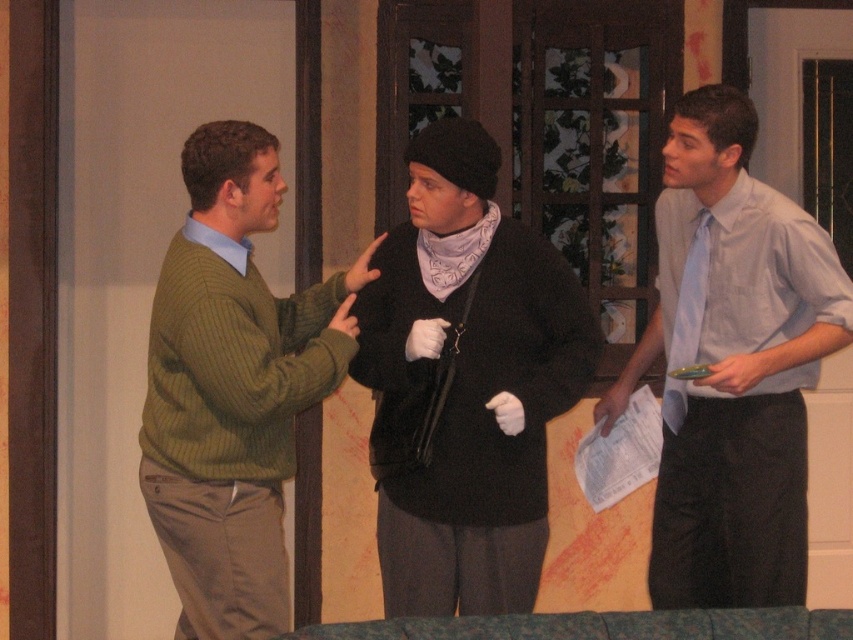
Question: Can you confirm if light blue shirt at right is positioned below green ribbed sweater at left?

Choices:
 (A) no
 (B) yes

Answer: (A)

Question: Which object appears closest to the camera in this image?

Choices:
 (A) light blue shirt at right
 (B) green ribbed sweater at left
 (C) black sweater at center

Answer: (B)

Question: Estimate the real-world distances between objects in this image. Which object is closer to the light blue shirt at right?

Choices:
 (A) green ribbed sweater at left
 (B) black sweater at center

Answer: (B)

Question: Can you confirm if black sweater at center is positioned to the left of green ribbed sweater at left?

Choices:
 (A) yes
 (B) no

Answer: (B)

Question: Does black sweater at center appear under green ribbed sweater at left?

Choices:
 (A) yes
 (B) no

Answer: (B)

Question: Which of the following is the farthest from the observer?

Choices:
 (A) green ribbed sweater at left
 (B) black sweater at center
 (C) light blue shirt at right

Answer: (C)